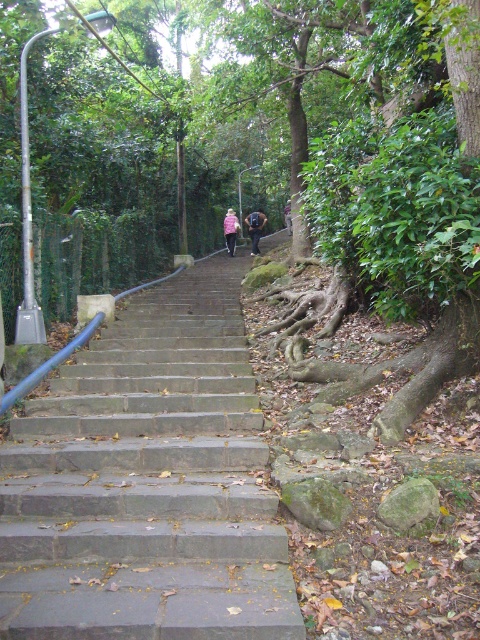
Question: Where is pink fabric at upper center located in relation to dark pink fabric at center in the image?

Choices:
 (A) below
 (B) above

Answer: (A)

Question: Considering the relative positions of gray concrete stairs at center and pink fabric jacket at upper center in the image provided, where is gray concrete stairs at center located with respect to pink fabric jacket at upper center?

Choices:
 (A) above
 (B) below

Answer: (B)

Question: In this image, where is gray concrete stairs at center located relative to pink fabric jacket at upper center?

Choices:
 (A) right
 (B) left

Answer: (A)

Question: Which object is positioned closest to the pink fabric jacket at upper center?

Choices:
 (A) dark pink fabric at center
 (B) pink fabric at upper center
 (C) gray concrete stairs at center

Answer: (B)

Question: Which of the following is the farthest from the observer?

Choices:
 (A) pink fabric at upper center
 (B) pink fabric jacket at upper center
 (C) dark pink fabric at center
 (D) gray concrete stairs at center

Answer: (B)

Question: Which point is farther to the camera?

Choices:
 (A) pink fabric jacket at upper center
 (B) gray concrete stairs at center
 (C) dark pink fabric at center
 (D) pink fabric at upper center

Answer: (A)